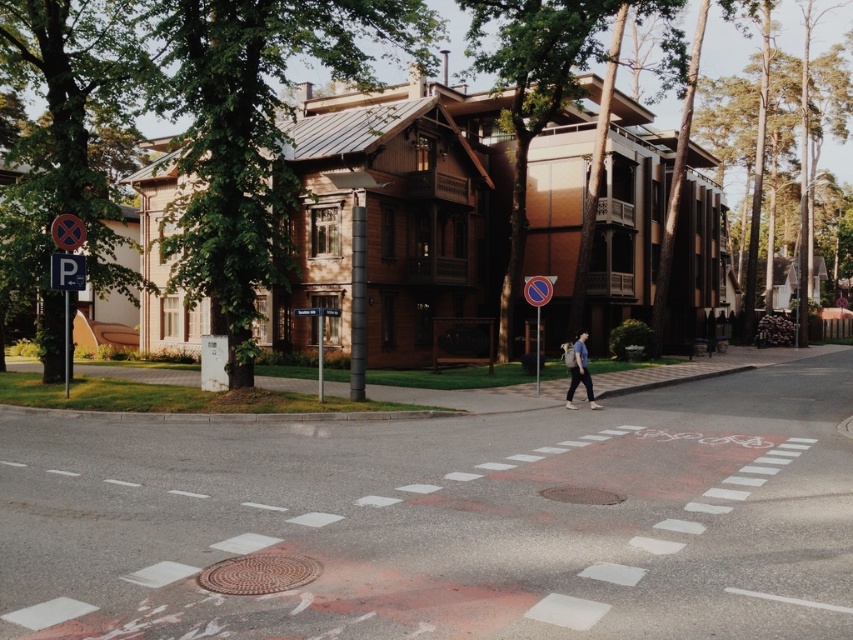
Describe the element at coordinates (253, 136) in the screenshot. The width and height of the screenshot is (853, 640). I see `green leafy tree at center` at that location.

Does green leafy tree at center appear over green leafy tree at left?

Yes, green leafy tree at center is above green leafy tree at left.

At what (x,y) coordinates should I click in order to perform the action: click on green leafy tree at center. Please return your answer as a coordinate pair (x, y). The height and width of the screenshot is (640, 853). Looking at the image, I should click on (253, 136).

Does point (567, 394) come behind point (538, 300)?

No, (567, 394) is closer to viewer.

Is point (584, 358) closer to viewer compared to point (550, 288)?

Yes, point (584, 358) is closer to viewer.

This screenshot has height=640, width=853. I want to click on blue cotton shirt at center, so click(579, 372).

Which of these two, green leafy tree at center or brown wood tree at upper left, stands taller?

brown wood tree at upper left

In order to click on green leafy tree at center in this screenshot , I will do `click(253, 136)`.

The height and width of the screenshot is (640, 853). What are the coordinates of `green leafy tree at center` in the screenshot? It's located at (253, 136).